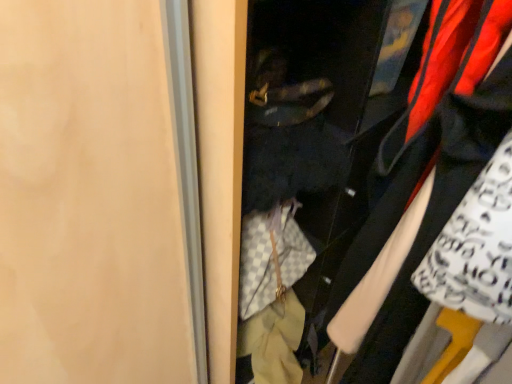
Question: Should I look upward or downward to see checkerboard fabric purse at center?

Choices:
 (A) up
 (B) down

Answer: (B)